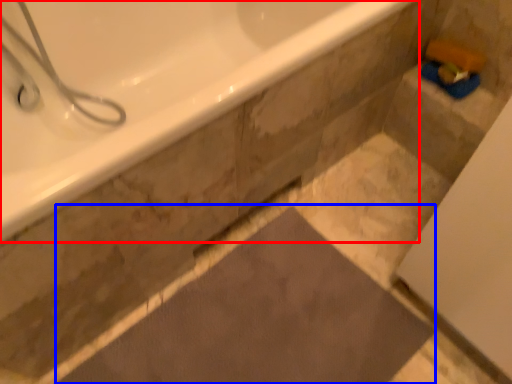
Question: Which object is closer to the camera taking this photo, bathtub (highlighted by a red box) or bath mat (highlighted by a blue box)?

Choices:
 (A) bathtub
 (B) bath mat

Answer: (A)